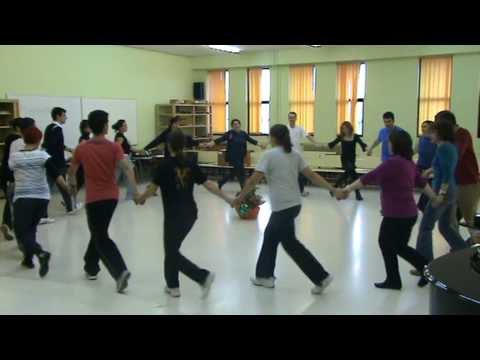
I want to click on window, so click(x=263, y=92).